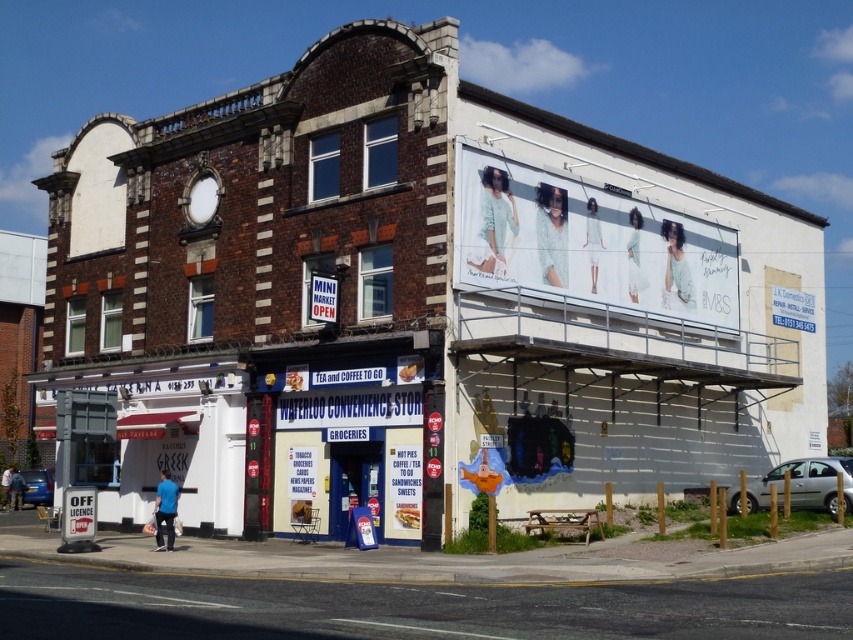
You are a customer standing in front of the Waterloo Convenience Store. You notice a silver metallic van at lower right and a metallic blue sedan at lower left parked nearby. Which vehicle is positioned higher in the image?

The silver metallic van at lower right is positioned higher in the image than the metallic blue sedan at lower left.

You are standing at the entrance of the Waterloo Convenience Store. You want to get to the silver metallic van at lower right. Which direction should you walk to reach it?

You should walk towards the lower right direction to reach the silver metallic van at lower right.

You are standing in front of the Waterloo Convenience Store and want to take a photo of the advertisement banner. Which point, point (781, 497) or point (45, 477), is closer to your camera lens?

Point (781, 497) is closer to the camera than point (45, 477), so it will appear nearer in your photo.